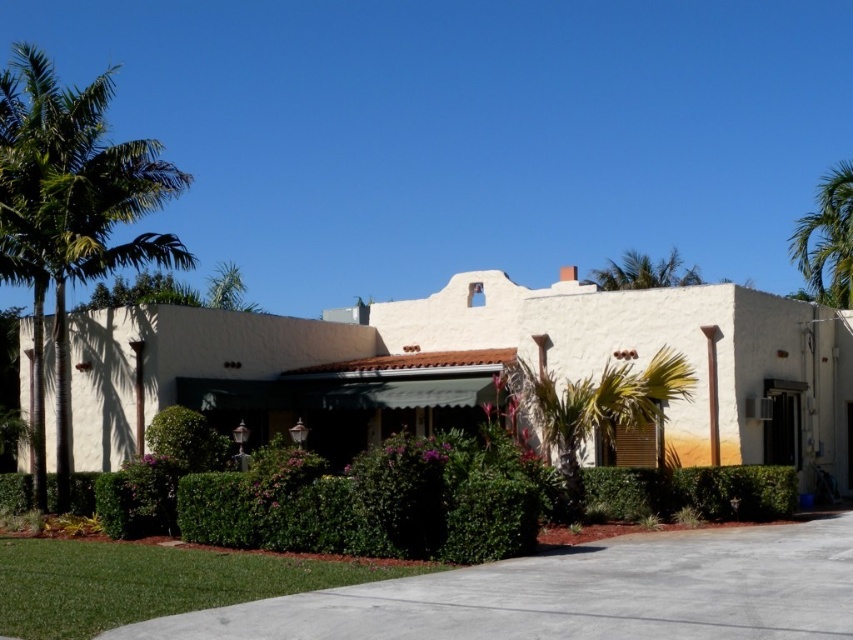
You are standing in front of the Spanish style building and want to take a photo. There are two points marked in the scene, point 1 at coordinates point (148, 557) and point 2 at coordinates point (640, 264). Which point is closer to you?

Point (148, 557) is closer to the camera than point (640, 264), so point 1 is closer to you.